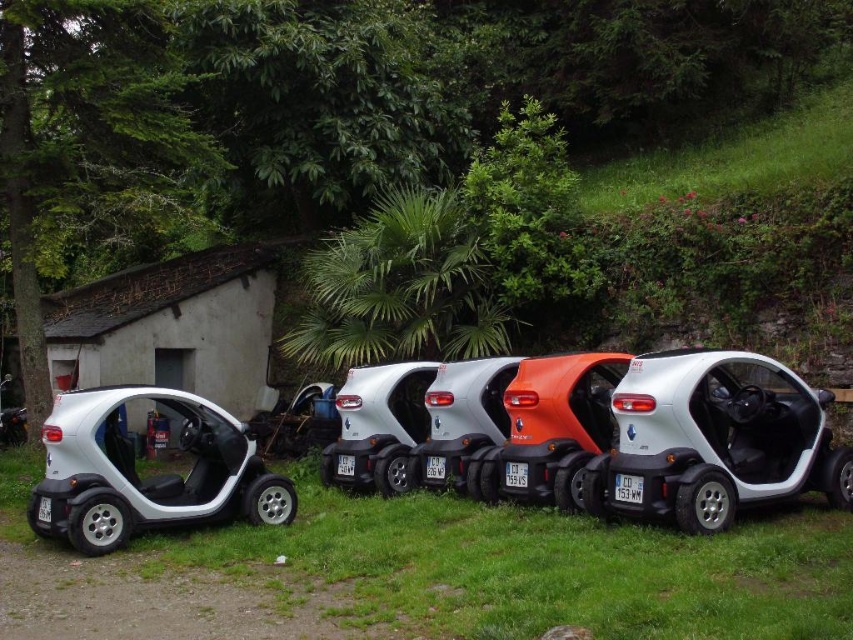
Between green grass at center and satin silver car at center, which one is positioned higher?

Positioned higher is satin silver car at center.

Is green grass at center bigger than satin silver car at center?

Incorrect, green grass at center is not larger than satin silver car at center.

This screenshot has width=853, height=640. I want to click on green grass at center, so click(x=548, y=566).

Identify the location of green grass at center. (548, 566).

Is white matte car at center closer to camera compared to satin silver car at center?

Yes, white matte car at center is closer to the viewer.

Based on the photo, does white matte car at center have a lesser width compared to satin silver car at center?

In fact, white matte car at center might be wider than satin silver car at center.

I want to click on white matte car at center, so click(714, 440).

Where is `white matte car at left`? The width and height of the screenshot is (853, 640). white matte car at left is located at coordinates (149, 476).

What are the coordinates of `white matte car at left` in the screenshot? It's located at (149, 476).

The image size is (853, 640). I want to click on white matte car at left, so click(149, 476).